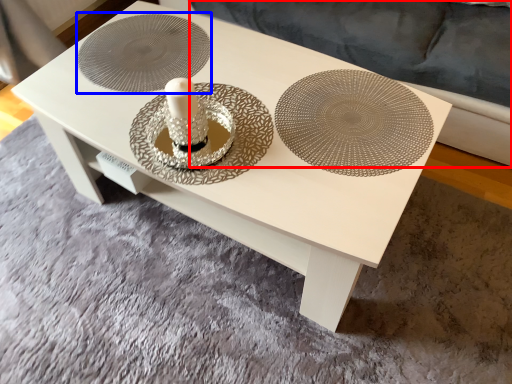
Question: Which object is further to the camera taking this photo, couch (highlighted by a red box) or circle (highlighted by a blue box)?

Choices:
 (A) couch
 (B) circle

Answer: (B)